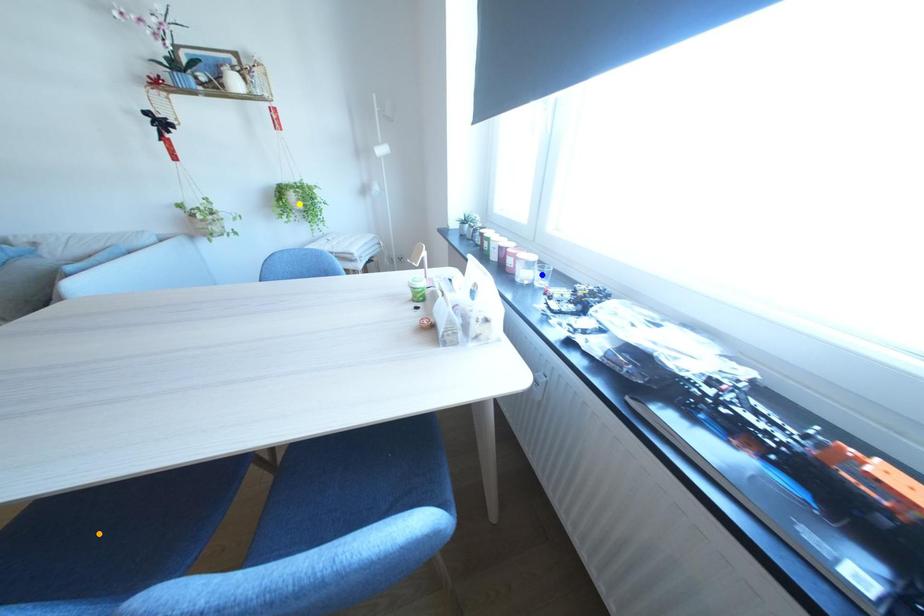
Order these from nearest to farthest:
blue point
yellow point
orange point

yellow point → blue point → orange point